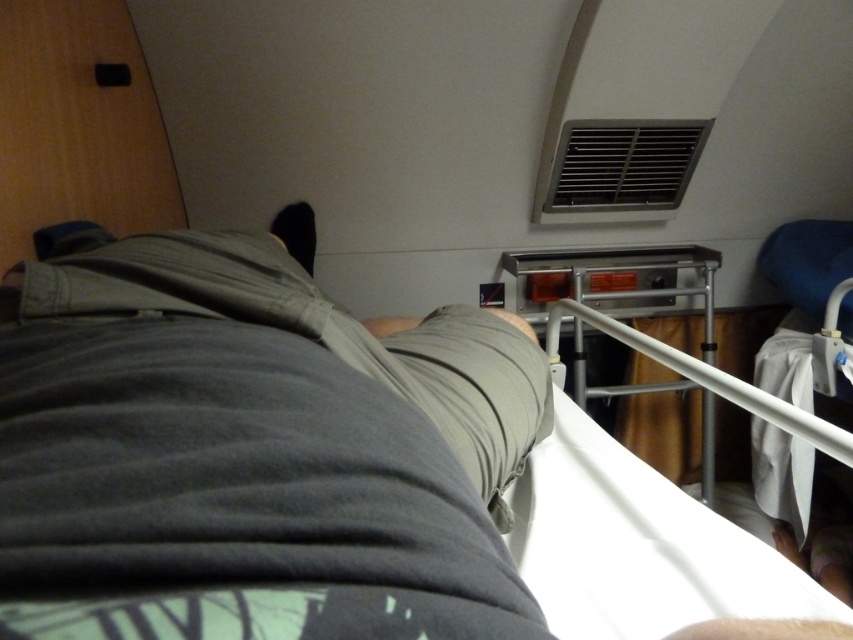
Image resolution: width=853 pixels, height=640 pixels. Describe the element at coordinates (253, 451) in the screenshot. I see `gray cotton shorts at center` at that location.

Does point (167, 276) lie in front of point (705, 291)?

Yes, it is in front of point (705, 291).

Locate an element on the screen. gray cotton shorts at center is located at coordinates (253, 451).

Who is taller, gray cotton shorts at center or white plastic hospital bed at lower right?

Standing taller between the two is white plastic hospital bed at lower right.

Does point (15, 481) come behind point (596, 621)?

No, (15, 481) is in front of (596, 621).

This screenshot has width=853, height=640. I want to click on gray cotton shorts at center, so click(x=253, y=451).

Is point (733, 604) positioned before point (711, 444)?

Yes, it is.

Is point (746, 545) closer to viewer compared to point (712, 364)?

Yes, it is.

Where is `white plastic hospital bed at lower right`? Image resolution: width=853 pixels, height=640 pixels. white plastic hospital bed at lower right is located at coordinates (636, 545).